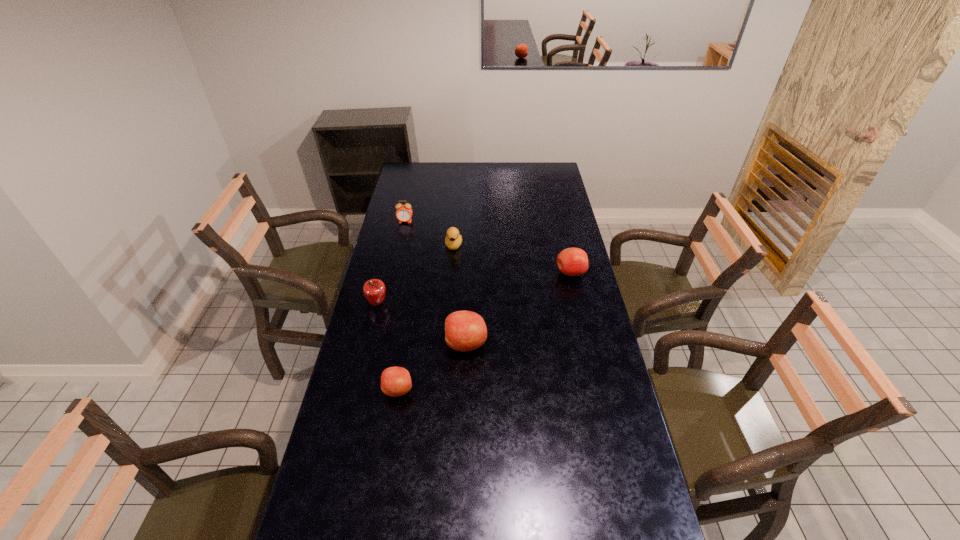
Where is `location for an additional apple to make spacing equal`? The image size is (960, 540). location for an additional apple to make spacing equal is located at coordinates (522, 305).